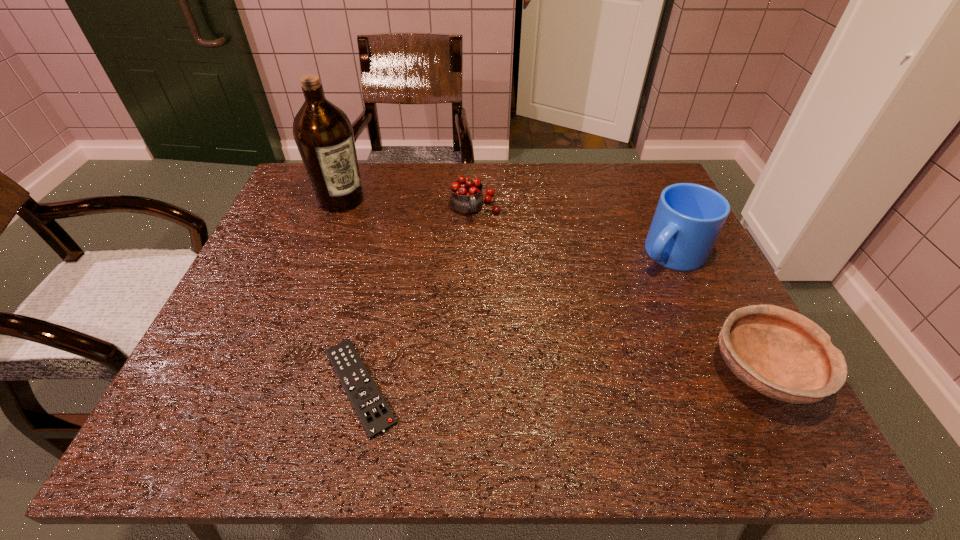
Find the location of a particular element. The width and height of the screenshot is (960, 540). blank area at the right edge is located at coordinates (672, 339).

At what (x,y) coordinates should I click in order to perform the action: click on free point between the third farthest object and the fourth tallest object. Please return your answer as a coordinate pair (x, y). The height and width of the screenshot is (540, 960). Looking at the image, I should click on (717, 313).

I want to click on free spot between the third nearest object and the olive oil, so click(506, 227).

You are a GUI agent. You are given a task and a screenshot of the screen. Output one action in this format:
    pyautogui.click(x=<x>, y=<y>)
    Task: Click on the free area in between the third nearest object and the pot filled with cherries
    The image size is (960, 540).
    Given the screenshot: What is the action you would take?
    pyautogui.click(x=573, y=231)

This screenshot has height=540, width=960. I want to click on empty space that is in between the third object from right to left and the olive oil, so click(x=408, y=204).

Identify the location of unoccupied area between the bowl and the shortest object. This screenshot has height=540, width=960. (562, 379).

Find the location of `empty space that is in between the olive oil and the third nearest object`. empty space that is in between the olive oil and the third nearest object is located at coordinates (506, 227).

The height and width of the screenshot is (540, 960). I want to click on free point between the shortest object and the third farthest object, so click(x=516, y=320).

The image size is (960, 540). What are the coordinates of `free space between the mug and the leftmost object` in the screenshot? It's located at point(506,227).

I want to click on vacant space that's between the olive oil and the pot filled with cherries, so click(x=408, y=204).